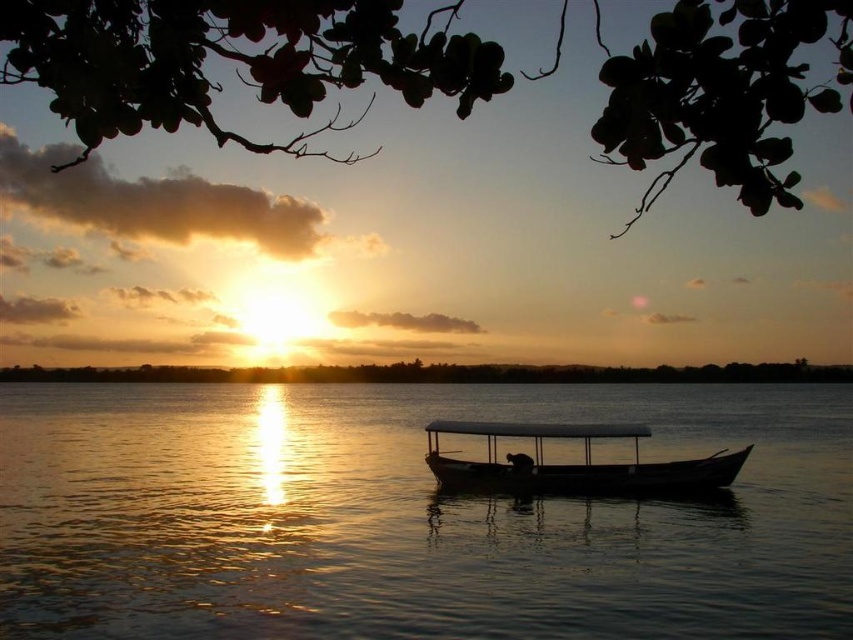
You are an observer standing on the shore looking at the silvery reflective water at center and the smooth wooden boat at center. Which object covers a larger area in the scene?

The silvery reflective water at center covers a larger area than the smooth wooden boat at center according to the description.